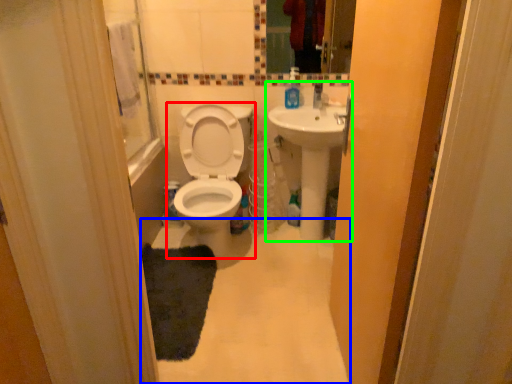
Question: Based on their relative distances, which object is farther from toilet (highlighted by a red box)? Choose from plain (highlighted by a blue box) and sink (highlighted by a green box).

Choices:
 (A) plain
 (B) sink

Answer: (A)